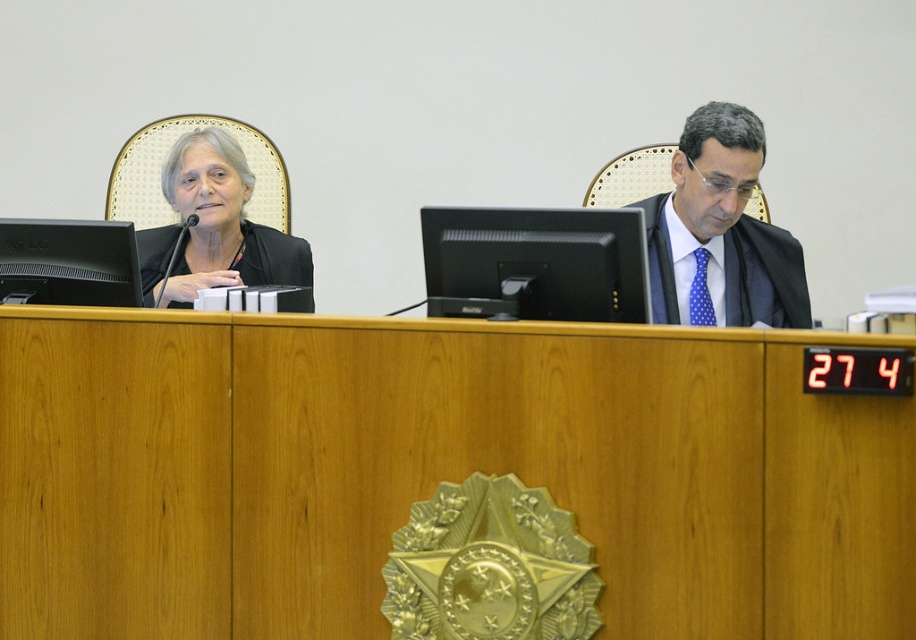
Is wooden table at center smaller than black matte business suit at left?

Actually, wooden table at center might be larger than black matte business suit at left.

Does wooden table at center have a greater width compared to black matte business suit at left?

Yes.

From the picture: Who is more forward, (263, 504) or (246, 225)?

Point (263, 504)

You are a GUI agent. You are given a task and a screenshot of the screen. Output one action in this format:
    pyautogui.click(x=<x>, y=<y>)
    Task: Click on the wooden table at center
    Image resolution: width=916 pixels, height=640 pixels.
    Given the screenshot: What is the action you would take?
    pyautogui.click(x=435, y=472)

Between point (450, 257) and point (297, 243), which one is positioned behind?

The point (297, 243) is more distant.

Does black glossy monitor at center have a larger size compared to black matte business suit at left?

No.

Is point (527, 230) positioned in front of point (304, 253)?

Yes.

Identify the location of black glossy monitor at center. The height and width of the screenshot is (640, 916). (535, 262).

This screenshot has width=916, height=640. Describe the element at coordinates (435, 472) in the screenshot. I see `wooden table at center` at that location.

Based on the photo, who is more distant from viewer, (x=189, y=352) or (x=711, y=109)?

The point (x=711, y=109) is more distant.

Identify the location of wooden table at center. The image size is (916, 640). (435, 472).

Locate an element on the screen. This screenshot has height=640, width=916. wooden table at center is located at coordinates (435, 472).